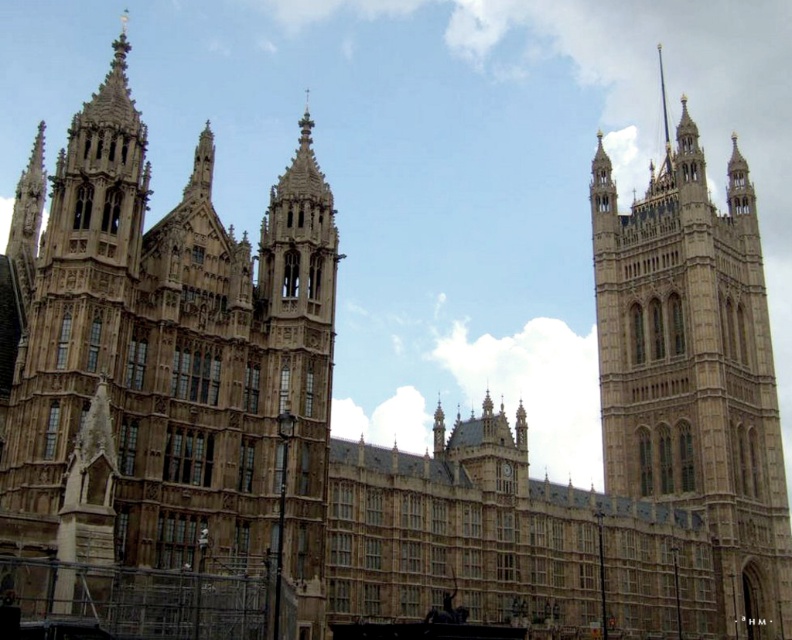
Which is more to the right, brown stone tower at left or beige stone tower at right?

Positioned to the right is beige stone tower at right.

Is brown stone tower at left closer to camera compared to beige stone tower at right?

Yes, it is in front of beige stone tower at right.

Does point (231, 275) come closer to viewer compared to point (600, 280)?

Yes, it is.

Locate an element on the screen. This screenshot has height=640, width=792. brown stone tower at left is located at coordinates (166, 356).